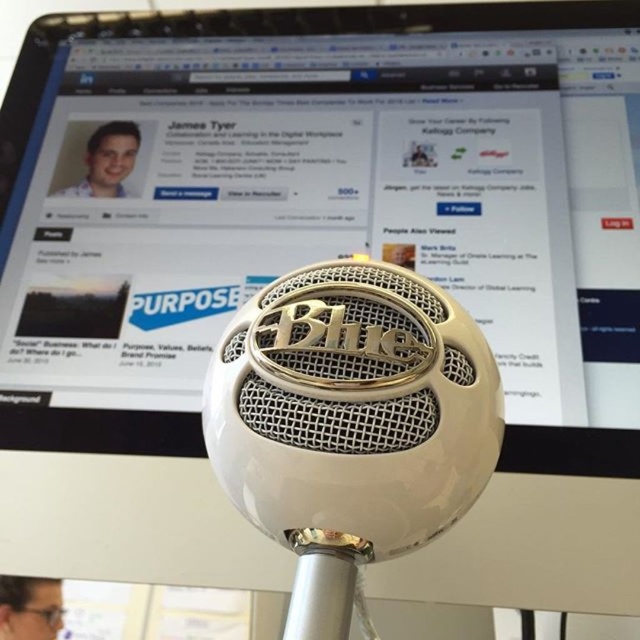
Question: Is white glossy microphone at center to the left of light blue shirt at upper left from the viewer's perspective?

Choices:
 (A) yes
 (B) no

Answer: (B)

Question: Is white glossy computer screen at center wider than matte black glasses at lower left?

Choices:
 (A) yes
 (B) no

Answer: (A)

Question: Among these objects, which one is farthest from the camera?

Choices:
 (A) light blue shirt at upper left
 (B) white glossy computer screen at center

Answer: (A)

Question: Among these objects, which one is farthest from the camera?

Choices:
 (A) white glossy microphone at center
 (B) light blue shirt at upper left

Answer: (B)

Question: Is white glossy computer screen at center thinner than white glossy microphone at center?

Choices:
 (A) no
 (B) yes

Answer: (A)

Question: Which point appears farthest from the camera in this image?

Choices:
 (A) (120, 138)
 (B) (44, 632)

Answer: (A)